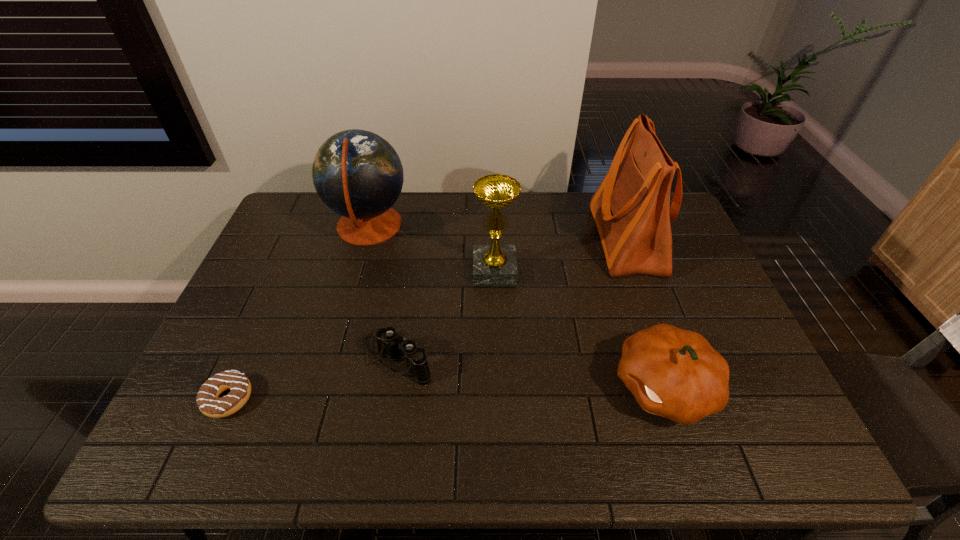
What are the coordinates of `object at the near edge` in the screenshot? It's located at (674, 373).

At what (x,y) coordinates should I click in order to perform the action: click on object situated at the left edge. Please return your answer as a coordinate pair (x, y). Looking at the image, I should click on (209, 404).

The height and width of the screenshot is (540, 960). Find the location of `shopping bag present at the right edge`. shopping bag present at the right edge is located at coordinates (631, 208).

Identify the location of pumpkin at the right edge. (674, 373).

Locate an element on the screen. This screenshot has height=540, width=960. object that is at the far right corner is located at coordinates (631, 208).

Locate an element on the screen. object located in the near right corner section of the desktop is located at coordinates (x=674, y=373).

Image resolution: width=960 pixels, height=540 pixels. In the image, there is a desktop. What are the coordinates of `vacant space at the far edge` in the screenshot? It's located at (591, 222).

In the image, there is a desktop. In order to click on vacant region at the near edge in this screenshot , I will do `click(517, 442)`.

Locate an element on the screen. vacant space at the left edge of the desktop is located at coordinates (205, 422).

Find the location of a particular element. The image size is (960, 540). vacant space at the right edge is located at coordinates (709, 314).